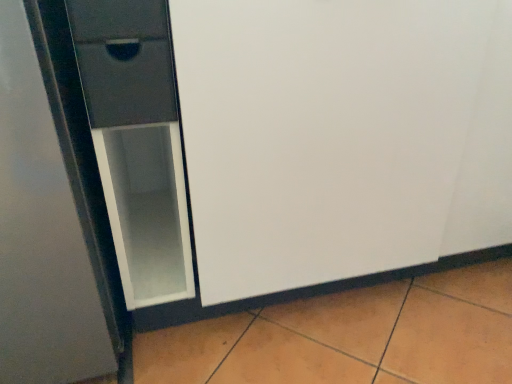
Question: Considering the relative positions of matte black drawer at upper left, the second drawer from the bottom, and matte glass screen door at left in the image provided, is matte black drawer at upper left, the second drawer from the bottom, to the left of matte glass screen door at left from the viewer's perspective?

Choices:
 (A) yes
 (B) no

Answer: (A)

Question: Can you confirm if matte black drawer at upper left, the second drawer from the bottom, is bigger than matte glass screen door at left?

Choices:
 (A) no
 (B) yes

Answer: (A)

Question: Is matte black drawer at upper left, the second drawer from the bottom, thinner than matte glass screen door at left?

Choices:
 (A) no
 (B) yes

Answer: (B)

Question: Is matte black drawer at upper left, the second drawer from the bottom, facing away from matte glass screen door at left?

Choices:
 (A) yes
 (B) no

Answer: (A)

Question: Considering the relative sizes of matte black drawer at upper left, the 1th drawer when ordered from top to bottom, and matte glass screen door at left in the image provided, is matte black drawer at upper left, the 1th drawer when ordered from top to bottom, shorter than matte glass screen door at left?

Choices:
 (A) no
 (B) yes

Answer: (B)

Question: Considering the positions of point (99, 59) and point (117, 11), is point (99, 59) closer or farther from the camera than point (117, 11)?

Choices:
 (A) farther
 (B) closer

Answer: (A)

Question: From the image's perspective, is matte black drawer at left, which appears as the 1th drawer when ordered from the bottom, above or below matte black drawer at upper left, the 1th drawer when ordered from top to bottom?

Choices:
 (A) above
 (B) below

Answer: (B)

Question: Is matte black drawer at left, which appears as the 1th drawer when ordered from the bottom, taller or shorter than matte black drawer at upper left, the 1th drawer when ordered from top to bottom?

Choices:
 (A) tall
 (B) short

Answer: (A)

Question: Based on their positions, is matte black drawer at left, which is the 2th drawer from top to bottom, located to the left or right of matte black drawer at upper left, the 1th drawer when ordered from top to bottom?

Choices:
 (A) right
 (B) left

Answer: (A)

Question: Is matte glass screen door at left wider or thinner than matte black drawer at upper left, the second drawer from the bottom?

Choices:
 (A) thin
 (B) wide

Answer: (B)

Question: From their relative heights in the image, would you say matte glass screen door at left is taller or shorter than matte black drawer at upper left, the 1th drawer when ordered from top to bottom?

Choices:
 (A) tall
 (B) short

Answer: (A)

Question: Is matte glass screen door at left spatially inside matte black drawer at upper left, the 1th drawer when ordered from top to bottom, or outside of it?

Choices:
 (A) outside
 (B) inside

Answer: (A)

Question: From a real-world perspective, is matte glass screen door at left positioned above or below matte black drawer at upper left, the second drawer from the bottom?

Choices:
 (A) below
 (B) above

Answer: (A)

Question: Based on their sizes in the image, would you say matte black drawer at upper left, the 1th drawer when ordered from top to bottom, is bigger or smaller than matte black drawer at left, which appears as the 1th drawer when ordered from the bottom?

Choices:
 (A) big
 (B) small

Answer: (B)

Question: In the image, is matte black drawer at upper left, the second drawer from the bottom, positioned in front of or behind matte black drawer at left, which appears as the 1th drawer when ordered from the bottom?

Choices:
 (A) behind
 (B) front

Answer: (B)